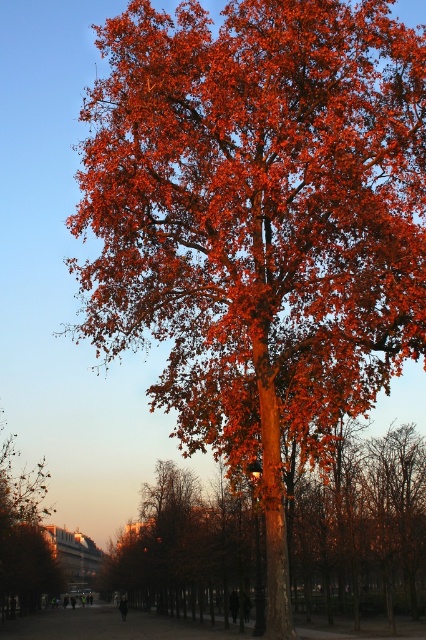
You are standing in an autumn park and see the point marked at coordinates (362, 531). What is located at that point?

The point at coordinates (362, 531) marks shiny orange leaves at center.